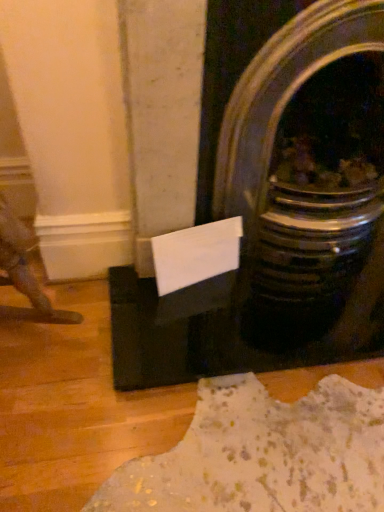
Identify the location of matte black fireplace at center. Image resolution: width=384 pixels, height=512 pixels. (277, 202).

What do you see at coordinates (277, 202) in the screenshot? The image size is (384, 512). I see `matte black fireplace at center` at bounding box center [277, 202].

Locate an element on the screen. Image resolution: width=384 pixels, height=512 pixels. matte black fireplace at center is located at coordinates (277, 202).